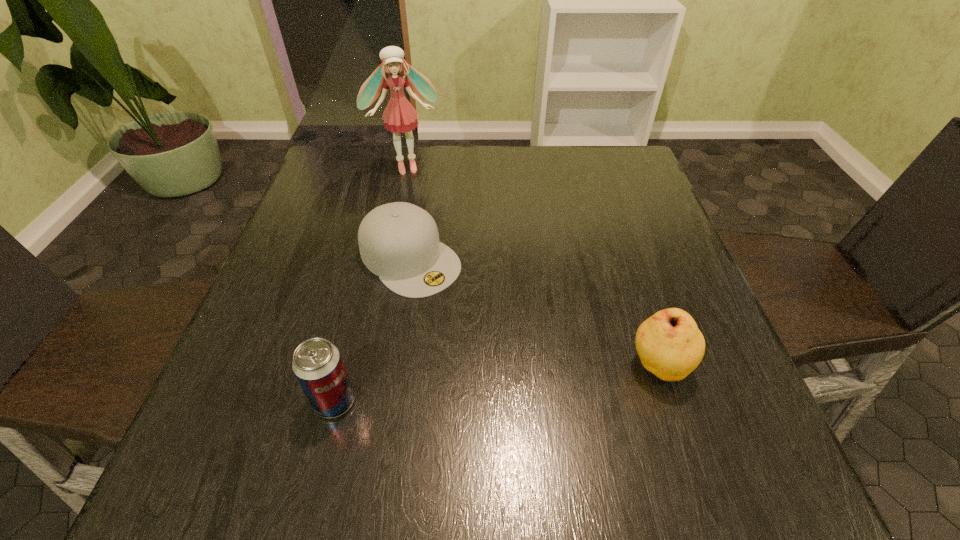
Find the location of `free space on the desktop that is between the beer can and the rightmost object and is positioned on the front-facing side of the tallest object`. free space on the desktop that is between the beer can and the rightmost object and is positioned on the front-facing side of the tallest object is located at coordinates (459, 388).

Where is `vacant spot on the desktop that is between the beer can and the rightmost object and is positioned on the front-facing side of the third nearest object`? The width and height of the screenshot is (960, 540). vacant spot on the desktop that is between the beer can and the rightmost object and is positioned on the front-facing side of the third nearest object is located at coordinates (548, 378).